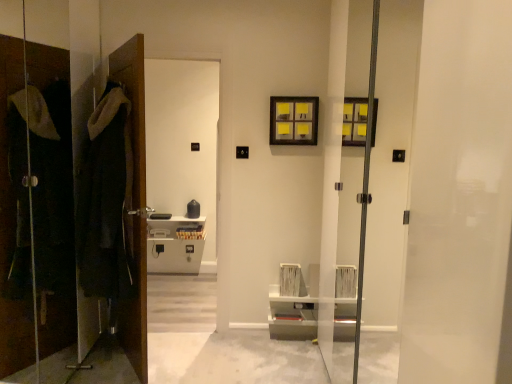
Question: Is wooden picture frame at upper center far away from dark woolen robe at left?

Choices:
 (A) no
 (B) yes

Answer: (B)

Question: Is dark woolen robe at left inside wooden picture frame at upper center?

Choices:
 (A) yes
 (B) no

Answer: (B)

Question: Is wooden picture frame at upper center to the right of dark woolen robe at left from the viewer's perspective?

Choices:
 (A) no
 (B) yes

Answer: (B)

Question: Is wooden picture frame at upper center placed right next to dark woolen robe at left?

Choices:
 (A) yes
 (B) no

Answer: (B)

Question: From the image's perspective, is wooden picture frame at upper center located above dark woolen robe at left?

Choices:
 (A) yes
 (B) no

Answer: (A)

Question: Looking at their shapes, would you say wooden picture frame at upper center is wider or thinner than matte black coat at left?

Choices:
 (A) wide
 (B) thin

Answer: (A)

Question: Considering their positions, is wooden picture frame at upper center located in front of or behind matte black coat at left?

Choices:
 (A) front
 (B) behind

Answer: (B)

Question: Is wooden picture frame at upper center taller or shorter than matte black coat at left?

Choices:
 (A) short
 (B) tall

Answer: (A)

Question: From the image's perspective, is wooden picture frame at upper center positioned above or below matte black coat at left?

Choices:
 (A) below
 (B) above

Answer: (B)

Question: Considering the positions of point pos(108,109) and point pos(124,71), is point pos(108,109) closer or farther from the camera than point pos(124,71)?

Choices:
 (A) farther
 (B) closer

Answer: (B)

Question: Based on their sizes in the image, would you say dark woolen robe at left is bigger or smaller than matte black coat at left?

Choices:
 (A) big
 (B) small

Answer: (B)

Question: Is dark woolen robe at left situated inside matte black coat at left or outside?

Choices:
 (A) outside
 (B) inside

Answer: (A)

Question: From the image's perspective, is dark woolen robe at left located above or below matte black coat at left?

Choices:
 (A) below
 (B) above

Answer: (A)

Question: Is dark woolen robe at left in front of or behind wooden picture frame at upper center in the image?

Choices:
 (A) front
 (B) behind

Answer: (A)

Question: Is point (116, 84) closer or farther from the camera than point (314, 109)?

Choices:
 (A) farther
 (B) closer

Answer: (B)